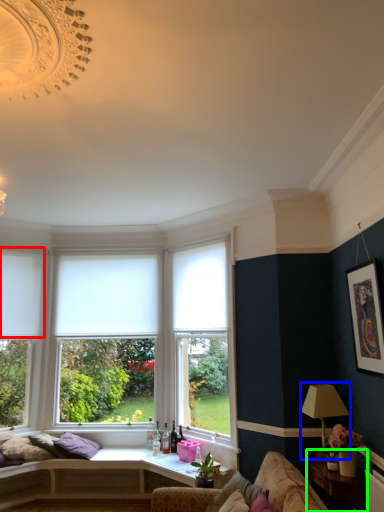
Question: Which object is positioned closest to curtain (highlighted by a red box)? Select from lamp (highlighted by a blue box) and table (highlighted by a green box).

Choices:
 (A) lamp
 (B) table

Answer: (A)